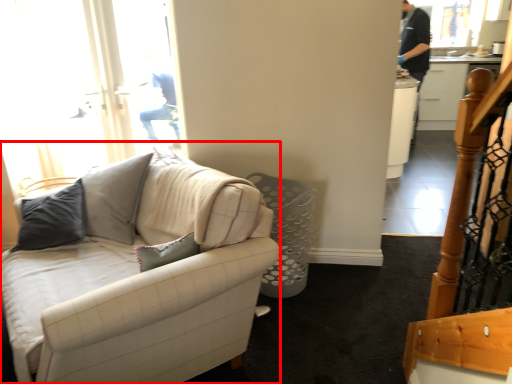
Question: From the image's perspective, where is studio couch (annotated by the red box) located relative to cabinetry?

Choices:
 (A) below
 (B) above

Answer: (A)